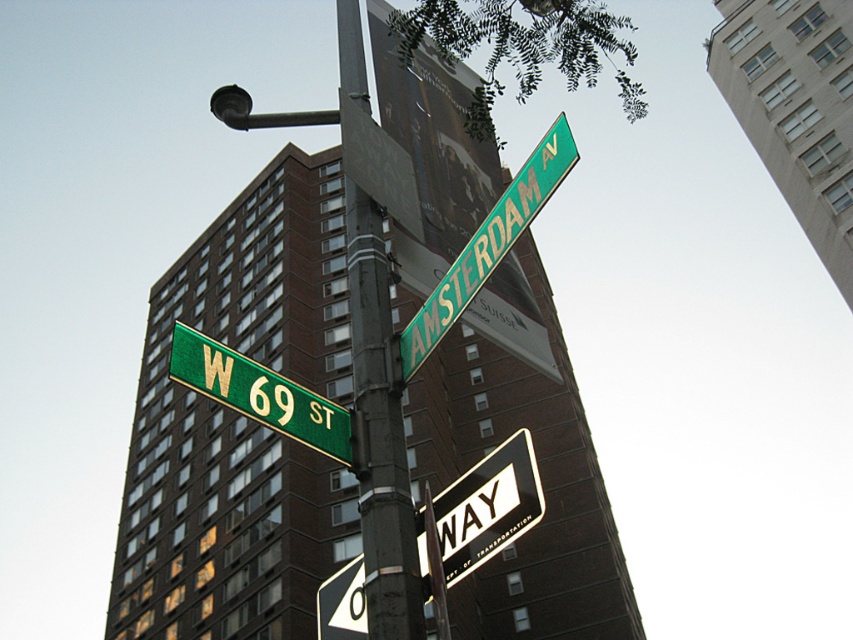
Question: Does metallic pole at center have a lesser width compared to white plastic one-way sign at upper center?

Choices:
 (A) no
 (B) yes

Answer: (A)

Question: Which object is farther from the camera taking this photo?

Choices:
 (A) green matte street sign at upper left
 (B) metallic pole at center

Answer: (A)

Question: Can you confirm if metallic pole at center is bigger than green matte street sign at upper left?

Choices:
 (A) no
 (B) yes

Answer: (B)

Question: Is metallic pole at center below green matte street sign at upper left?

Choices:
 (A) yes
 (B) no

Answer: (B)

Question: Among these objects, which one is nearest to the camera?

Choices:
 (A) green metallic street sign at upper center
 (B) metallic pole at center
 (C) green matte street sign at upper left

Answer: (A)

Question: Which point is closer to the camera?

Choices:
 (A) (474, 536)
 (B) (479, 228)
 (C) (381, 285)

Answer: (A)